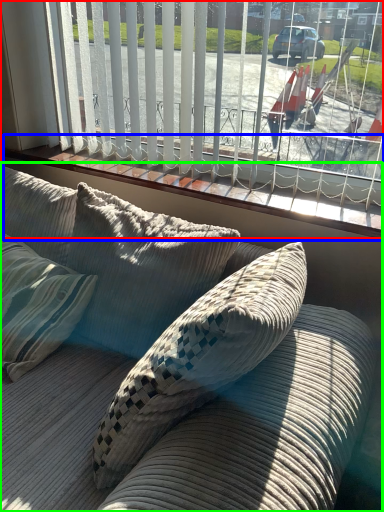
Question: Estimate the real-world distances between objects in this image. Which object is closer to window (highlighted by a red box), window sill (highlighted by a blue box) or studio couch (highlighted by a green box)?

Choices:
 (A) window sill
 (B) studio couch

Answer: (A)